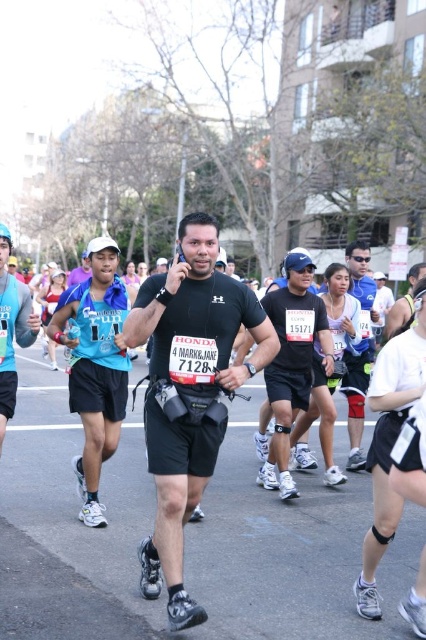
Question: Can you confirm if black matte running shorts at center is smaller than blue fabric shirt at left?

Choices:
 (A) no
 (B) yes

Answer: (A)

Question: Can you confirm if blue fabric shirt at left is positioned to the right of black matte shorts at center?

Choices:
 (A) yes
 (B) no

Answer: (B)

Question: Which object is the closest to the black matte shorts at center?

Choices:
 (A) matte black shorts at center
 (B) black matte running shorts at center
 (C) blue fabric shirt at left

Answer: (A)

Question: Which point is closer to the camera taking this photo?

Choices:
 (A) (176, 525)
 (B) (362, 333)
 (C) (293, 364)
 (D) (118, 284)

Answer: (A)

Question: Does blue fabric shirt at left appear over black matte shorts at center?

Choices:
 (A) no
 (B) yes

Answer: (A)

Question: Estimate the real-world distances between objects in this image. Which object is farther from the blue fabric shirt at left?

Choices:
 (A) black matte running shorts at center
 (B) matte black shorts at center

Answer: (B)